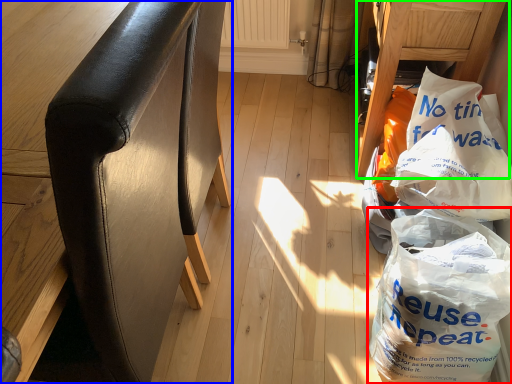
Question: Estimate the real-world distances between objects in this image. Which object is farther from plastic bag (highlighted by a red box), furniture (highlighted by a blue box) or furniture (highlighted by a green box)?

Choices:
 (A) furniture
 (B) furniture

Answer: (A)